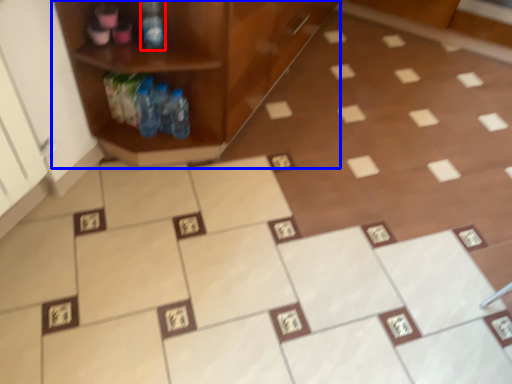
Question: Which of the following is the farthest to the observer, bottle (highlighted by a red box) or shelf (highlighted by a blue box)?

Choices:
 (A) bottle
 (B) shelf

Answer: (A)